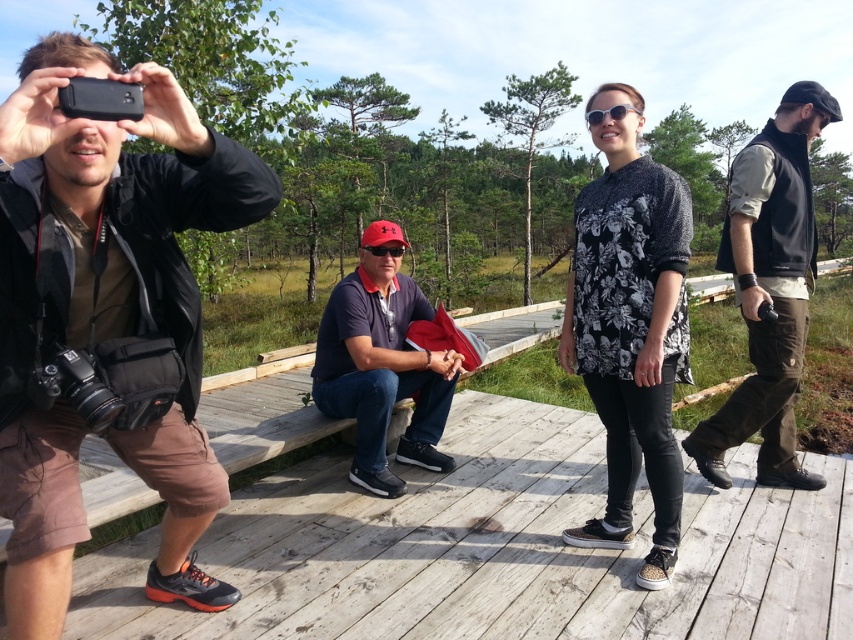
Based on the scene description, which object at the center has a greater width when comparing the dark blue cotton shirt at center and the white plastic goggles at center?

The dark blue cotton shirt at center has a greater width than the white plastic goggles at center according to the description.

You are standing at the wooden platform and want to take a photo that includes both the point at (x=422, y=456) and the point at (x=636, y=113). Which point should you focus on first to ensure both are in focus?

You should focus on the point at (x=422, y=456) first because it is closer to the camera than the point at (x=636, y=113). This ensures the closer point is in focus, and the farther point may also be within the depth of field.